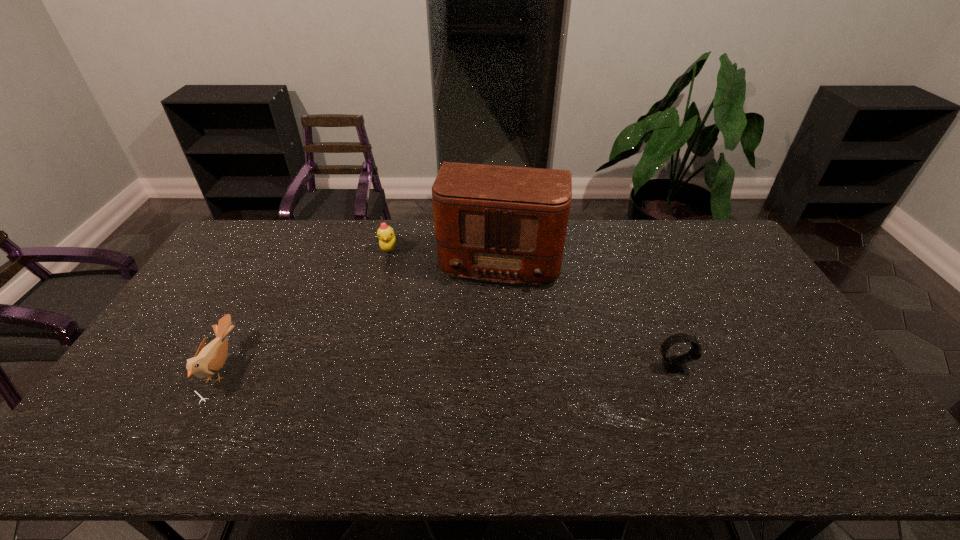
You are a GUI agent. You are given a task and a screenshot of the screen. Output one action in this format:
    pyautogui.click(x=<x>, y=<y>)
    Task: Click on the vacant space located 0.270m on the front panel of the radio receiver
    This screenshot has height=540, width=960.
    Given the screenshot: What is the action you would take?
    pyautogui.click(x=480, y=359)

In order to click on vacant space situated on the front panel of the radio receiver in this screenshot , I will do `click(479, 368)`.

Identify the location of free spot located 0.270m on the front-facing side of the duckling. (421, 303).

This screenshot has height=540, width=960. I want to click on vacant space located 0.140m on the front-facing side of the duckling, so click(406, 280).

Identify the location of vacant area situated 0.330m on the front-facing side of the duckling. This screenshot has height=540, width=960. (430, 316).

You are a GUI agent. You are given a task and a screenshot of the screen. Output one action in this format:
    pyautogui.click(x=<x>, y=<y>)
    Task: Click on the radio receiver located at the far edge
    
    Given the screenshot: What is the action you would take?
    click(507, 224)

Locate an element on the screen. This screenshot has height=540, width=960. duckling located in the far edge section of the desktop is located at coordinates (387, 241).

The height and width of the screenshot is (540, 960). Identify the location of object located in the near edge section of the desktop. (208, 360).

At what (x,y) coordinates should I click in order to perform the action: click on vacant space at the far edge. Please return your answer as a coordinate pair (x, y). Looking at the image, I should click on (357, 241).

Locate an element on the screen. vacant point at the near edge is located at coordinates (392, 414).